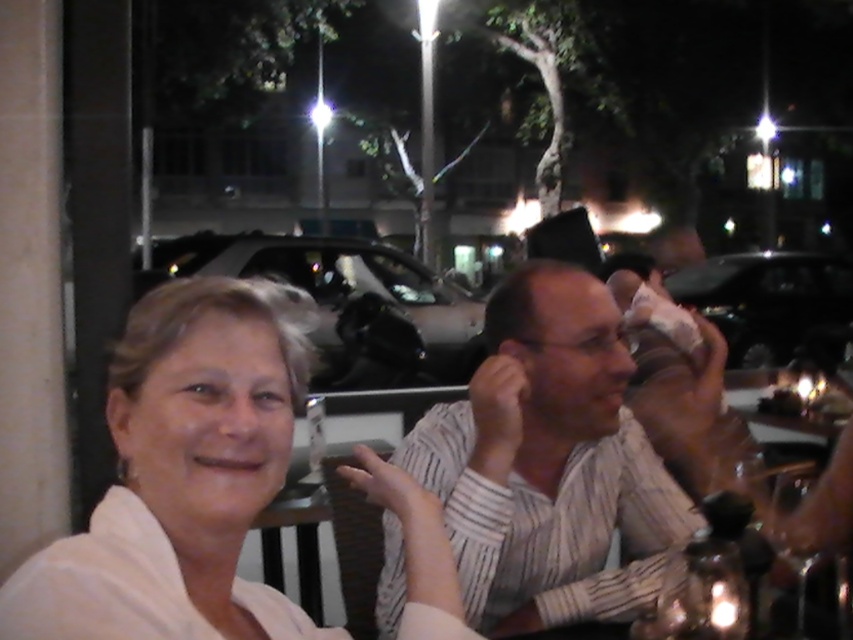
Between point (231, 486) and point (521, 496), which one is positioned behind?

Positioned behind is point (521, 496).

Does point (219, 525) come closer to viewer compared to point (630, 556)?

Yes, it is.

The width and height of the screenshot is (853, 640). I want to click on white matte shirt at center, so click(x=183, y=474).